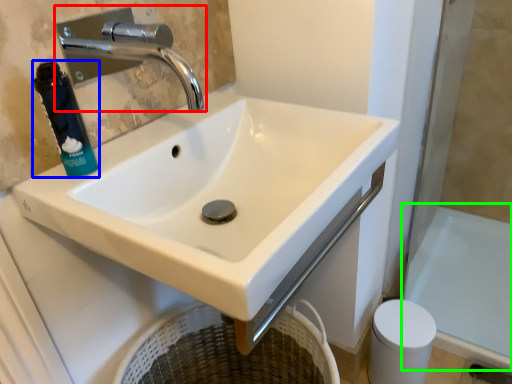
Question: Which is nearer to the tap (highlighted by a red box)? mouthwash (highlighted by a blue box) or bath (highlighted by a green box).

Choices:
 (A) mouthwash
 (B) bath

Answer: (A)